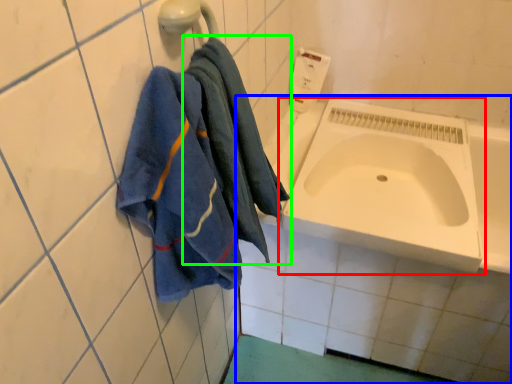
Question: Based on their relative distances, which object is farther from sink (highlighted by a red box)? Choose from bath (highlighted by a blue box) and towel (highlighted by a green box).

Choices:
 (A) bath
 (B) towel

Answer: (B)